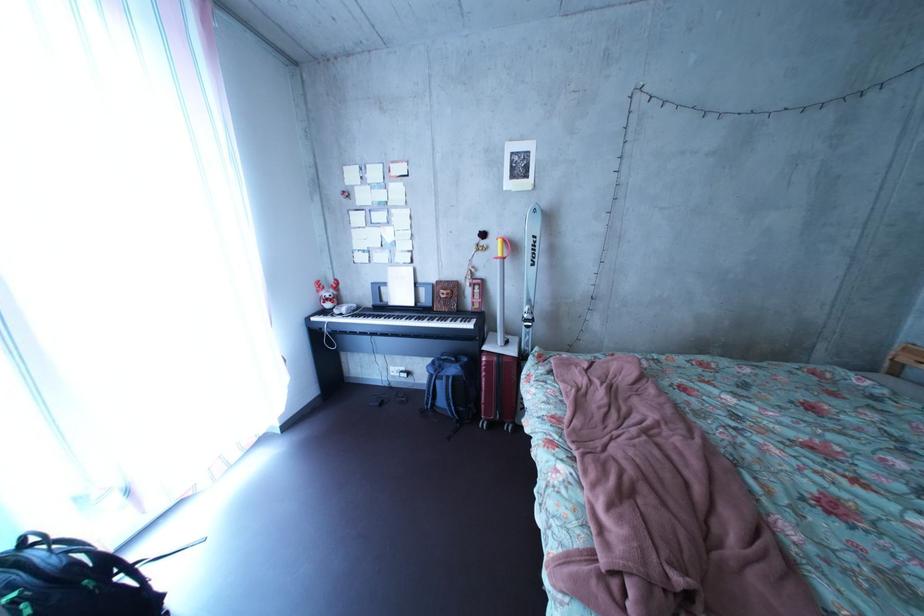
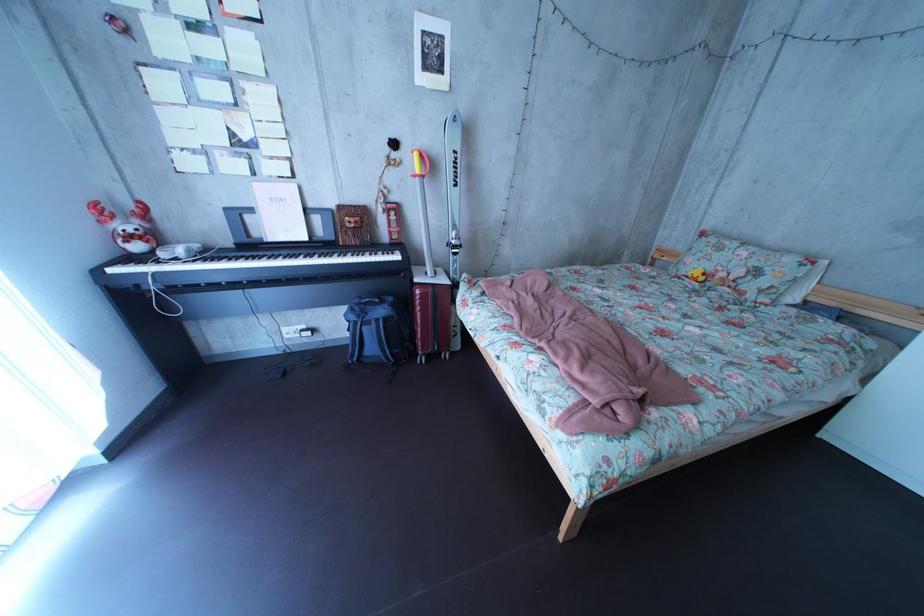
In the second image, find the point that corresponds to point 351,308 in the first image.

(169, 246)